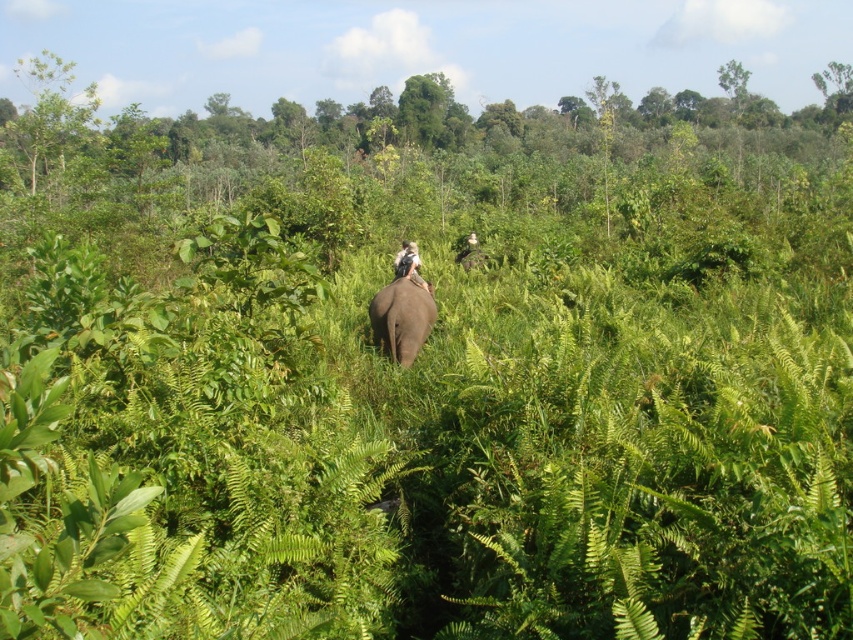
You are a hiker in the forest and want to cross a narrow path between the gray matte elephant at center and the white fabric at center. If the path is 2 meters wide, can your 1.5 meter wide backpack fit through?

The gray matte elephant at center is wider than the white fabric at center. Since the path is 2 meters wide, your 1.5 meter wide backpack can fit through the path between them.

In the scene shown: You are standing in the forest and want to take a photo of the green leafy tree at upper left. Since you have a limited field of view, which direction should you look to ensure the tree is in your sight?

The green leafy tree at upper left is located at point (49, 113), which is in the upper left area of the scene. To capture it in your photo, you should look towards the upper left direction.